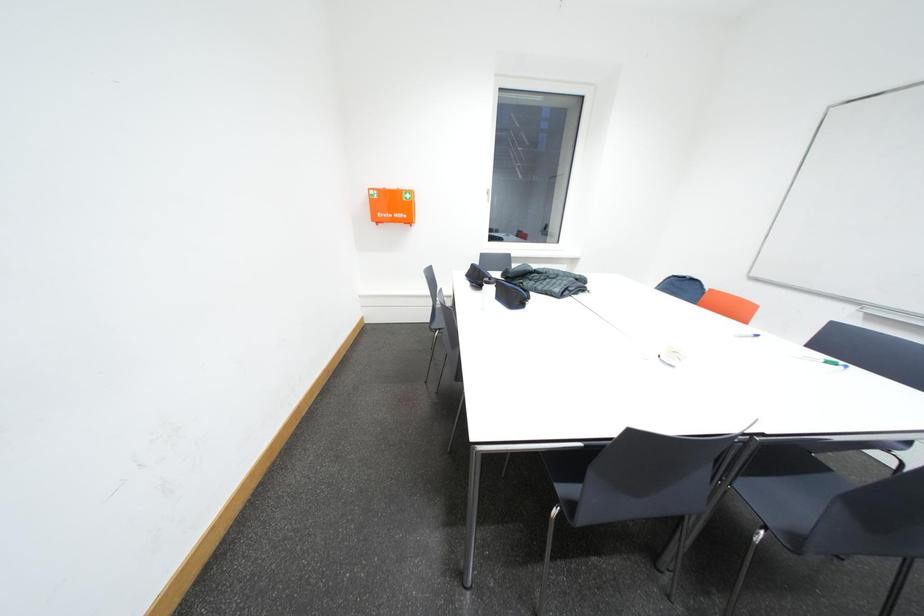
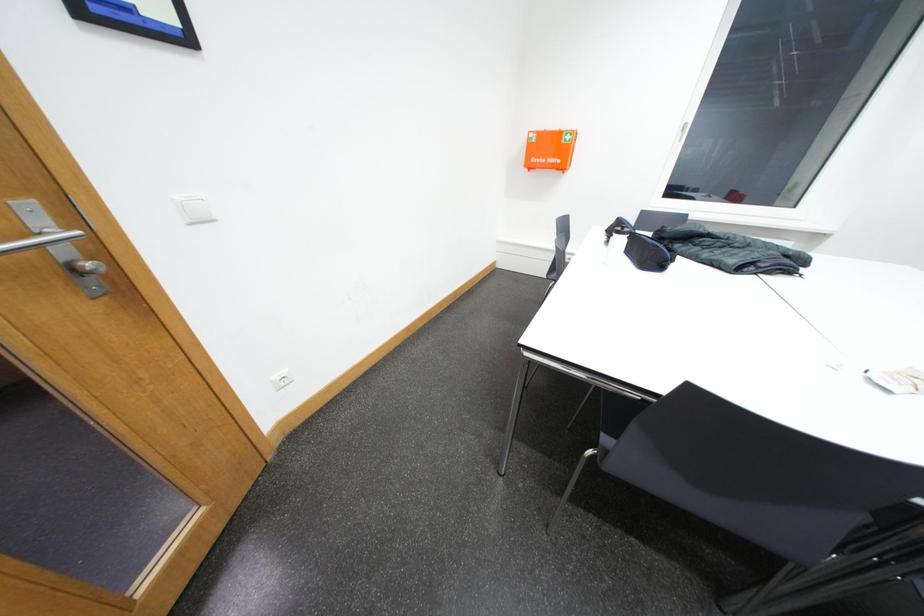
Question: The first image is from the beginning of the video and the second image is from the end. How did the camera likely rotate when shooting the video?

Choices:
 (A) Left
 (B) Right
 (C) Up
 (D) Down

Answer: (A)